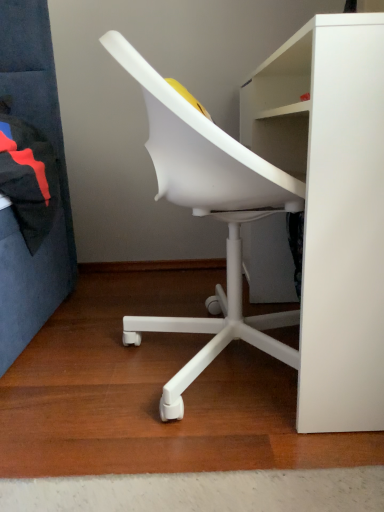
What are the coordinates of `white plastic chair at center` in the screenshot? It's located at (206, 215).

Describe the element at coordinates (206, 215) in the screenshot. I see `white plastic chair at center` at that location.

The width and height of the screenshot is (384, 512). What do you see at coordinates (332, 206) in the screenshot?
I see `white matte desk at center` at bounding box center [332, 206].

The height and width of the screenshot is (512, 384). Identify the location of white matte desk at center. (332, 206).

Find the location of a particular element. Image resolution: width=384 pixels, height=512 pixels. white plastic chair at center is located at coordinates (206, 215).

Visually, is white matte desk at center positioned to the left or to the right of white plastic chair at center?

Clearly, white matte desk at center is on the right of white plastic chair at center in the image.

Does white matte desk at center come in front of white plastic chair at center?

Yes, it is.

Which is in front, point (331, 420) or point (240, 320)?

The point (331, 420) is in front.

From the image's perspective, does white matte desk at center appear higher than white plastic chair at center?

Indeed, from the image's perspective, white matte desk at center is shown above white plastic chair at center.

From a real-world perspective, is white matte desk at center on white plastic chair at center?

No.

Which of these two, white matte desk at center or white plastic chair at center, is wider?

Wider between the two is white plastic chair at center.

Considering the relative sizes of white matte desk at center and white plastic chair at center in the image provided, is white matte desk at center shorter than white plastic chair at center?

Yes, white matte desk at center is shorter than white plastic chair at center.

Can you confirm if white matte desk at center is smaller than white plastic chair at center?

Actually, white matte desk at center might be larger than white plastic chair at center.

Is white matte desk at center not inside white plastic chair at center?

Yes, white matte desk at center is outside of white plastic chair at center.

Is white matte desk at center with white plastic chair at center?

white matte desk at center and white plastic chair at center are clearly separated.

Is white matte desk at center positioned with its back to white plastic chair at center?

That's right, white matte desk at center is facing away from white plastic chair at center.

You are a GUI agent. You are given a task and a screenshot of the screen. Output one action in this format:
    pyautogui.click(x=<x>, y=<y>)
    Task: Click on the chair below the white matte desk at center (from the image's perspective)
    
    Given the screenshot: What is the action you would take?
    pyautogui.click(x=206, y=215)

Which is more to the left, white plastic chair at center or white matte desk at center?

From the viewer's perspective, white plastic chair at center appears more on the left side.

Is the depth of white plastic chair at center greater than that of white matte desk at center?

Yes, it is.

Does point (272, 349) appear closer or farther from the camera than point (341, 305)?

Clearly, point (272, 349) is more distant from the camera than point (341, 305).

From the image's perspective, relative to white matte desk at center, is white plastic chair at center above or below?

white plastic chair at center is situated lower than white matte desk at center in the image.

From a real-world perspective, is white plastic chair at center located higher than white matte desk at center?

Indeed, from a real-world perspective, white plastic chair at center stands above white matte desk at center.

Which object is wider, white plastic chair at center or white matte desk at center?

With larger width is white plastic chair at center.

Which of these two, white plastic chair at center or white matte desk at center, stands taller?

white plastic chair at center is taller.

Considering the relative sizes of white plastic chair at center and white matte desk at center in the image provided, is white plastic chair at center smaller than white matte desk at center?

Correct, white plastic chair at center occupies less space than white matte desk at center.

Is white matte desk at center located within white plastic chair at center?

No, white matte desk at center is located outside of white plastic chair at center.

Is white plastic chair at center not near white matte desk at center?

No, white plastic chair at center is not far from white matte desk at center.

Could you tell me if white plastic chair at center is turned towards white matte desk at center?

Yes, white plastic chair at center is facing white matte desk at center.

How much distance is there between white plastic chair at center and white matte desk at center?

The distance of white plastic chair at center from white matte desk at center is 9.31 inches.

Where is `desk located in front of the white plastic chair at center`? This screenshot has height=512, width=384. desk located in front of the white plastic chair at center is located at coordinates (332, 206).

Locate an element on the screen. This screenshot has width=384, height=512. desk in front of the white plastic chair at center is located at coordinates (332, 206).

Locate an element on the screen. This screenshot has width=384, height=512. chair below the white matte desk at center (from the image's perspective) is located at coordinates (206, 215).